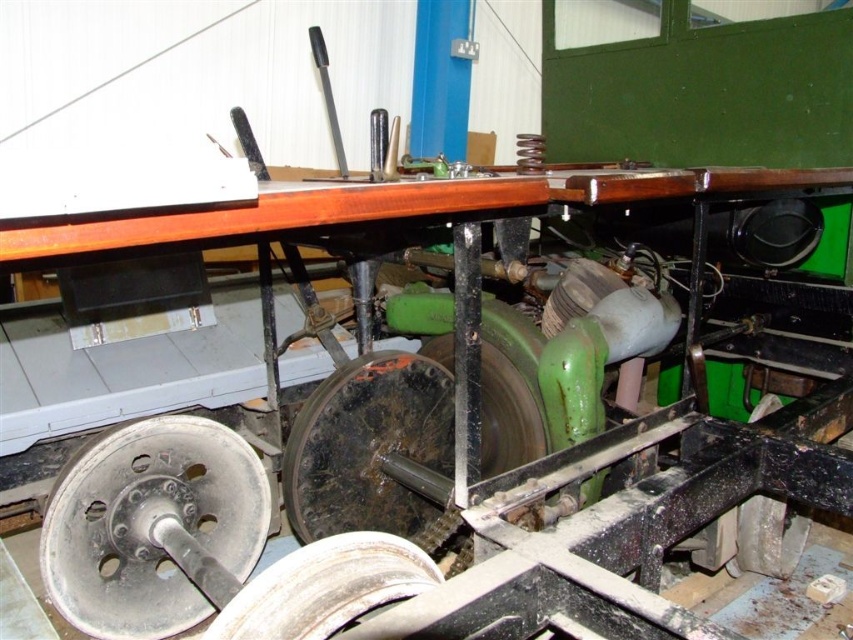
Does white rubber wheel at center appear on the left side of black rubber wheel at lower right?

Correct, you'll find white rubber wheel at center to the left of black rubber wheel at lower right.

This screenshot has width=853, height=640. What do you see at coordinates (325, 588) in the screenshot?
I see `white rubber wheel at center` at bounding box center [325, 588].

The height and width of the screenshot is (640, 853). I want to click on white rubber wheel at center, so click(325, 588).

How far apart are gray metallic wheel at lower left and black rubber wheel at center?

They are 30.00 centimeters apart.

Between gray metallic wheel at lower left and black rubber wheel at center, which one is positioned lower?

gray metallic wheel at lower left

Who is more forward, (194, 420) or (326, 529)?

Point (194, 420) is more forward.

What are the coordinates of `gray metallic wheel at lower left` in the screenshot? It's located at (154, 525).

Is point (448, 360) farther from camera compared to point (750, 531)?

Yes, it is behind point (750, 531).

From the picture: Does green rubber wheel at center have a greater width compared to black rubber wheel at lower right?

Correct, the width of green rubber wheel at center exceeds that of black rubber wheel at lower right.

The image size is (853, 640). What do you see at coordinates (506, 416) in the screenshot?
I see `green rubber wheel at center` at bounding box center [506, 416].

You are a GUI agent. You are given a task and a screenshot of the screen. Output one action in this format:
    pyautogui.click(x=<x>, y=<y>)
    Task: Click on the green rubber wheel at center
    This screenshot has height=640, width=853.
    Given the screenshot: What is the action you would take?
    pyautogui.click(x=506, y=416)